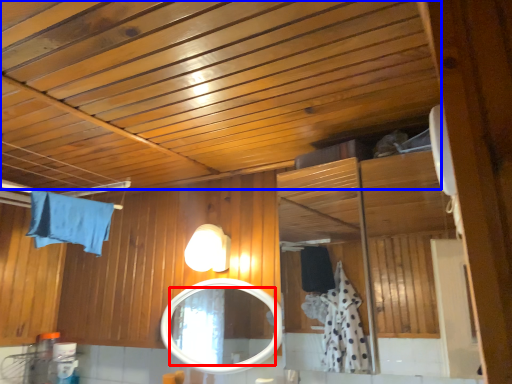
Question: Which of the following is the farthest to the observer, mirror (highlighted by a red box) or exhaust hood (highlighted by a blue box)?

Choices:
 (A) mirror
 (B) exhaust hood

Answer: (A)